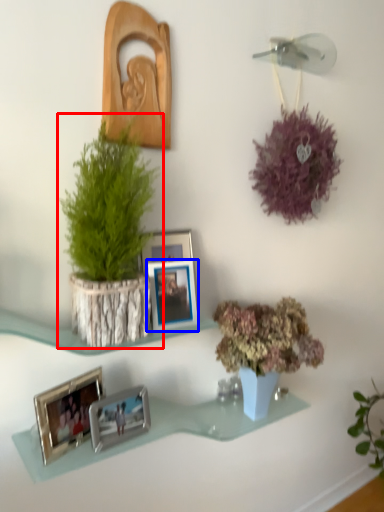
Question: Among these objects, which one is farthest to the camera, houseplant (highlighted by a red box) or picture frame (highlighted by a blue box)?

Choices:
 (A) houseplant
 (B) picture frame

Answer: (B)